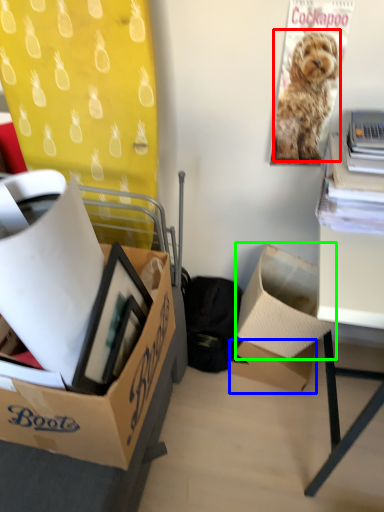
Question: Estimate the real-world distances between objects in this image. Which object is closer to dog (highlighted by a red box), box (highlighted by a blue box) or box (highlighted by a green box)?

Choices:
 (A) box
 (B) box

Answer: (B)